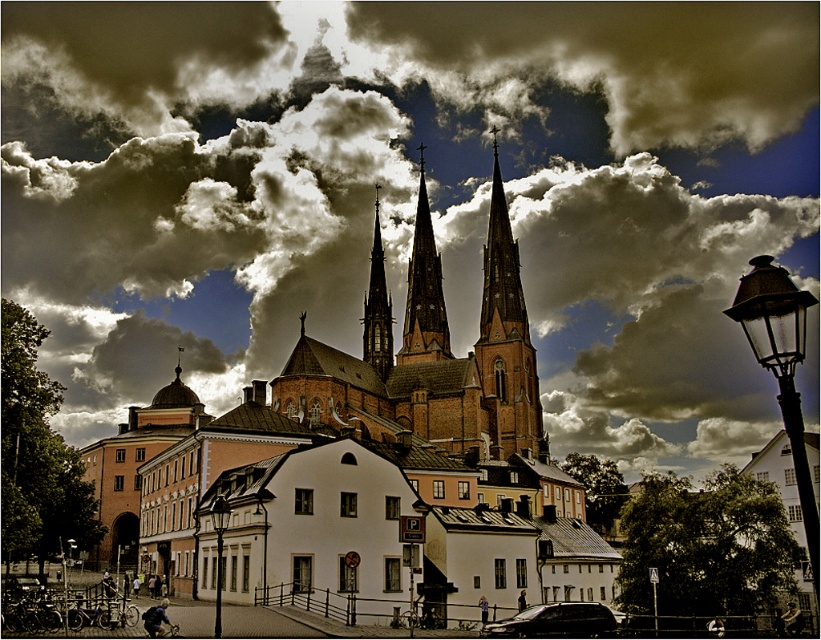
You are an architect analyzing the cathedral in the scene. You notice the brick steeple at center and the smooth stone spire at center. Which one is taller?

The brick steeple at center is taller than the smooth stone spire at center.

You are an architect analyzing the cathedral scene. You need to determine where the point at coordinates point (411, 195) is located in the image. Based on the scene description, can you identify what this point represents?

The point at coordinates point (411, 195) corresponds to the dark cloudy sky at upper center as per the objects description.

You are an architect analyzing the cathedral layout. Which structure, the brick steeple at center or the smooth stone spire at center, would you say is closer to the observer based on their positioning in the image?

The brick steeple at center is closer to the observer because it is positioned in front of the smooth stone spire at center.